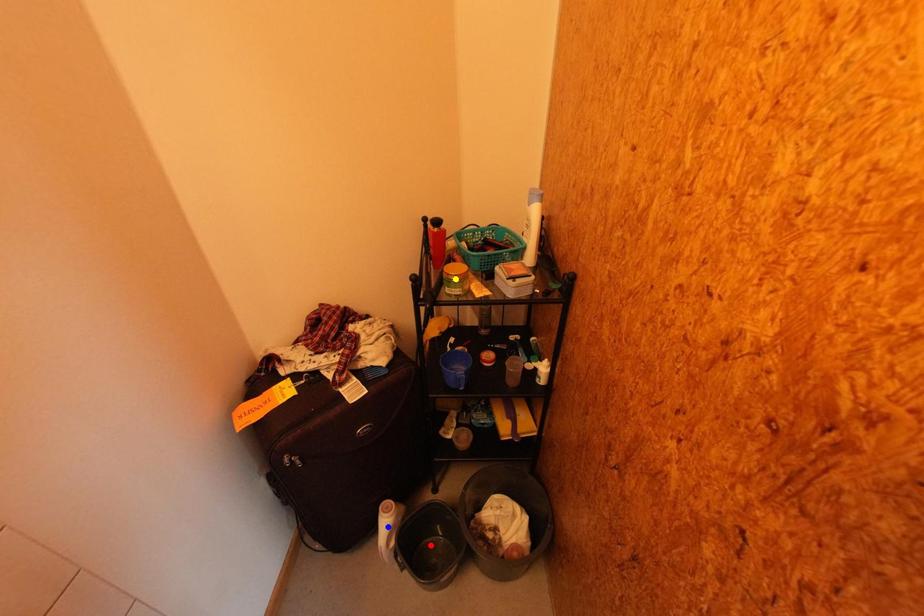
Order these from nearest to farthest:
1. red point
2. blue point
3. yellow point

yellow point < blue point < red point